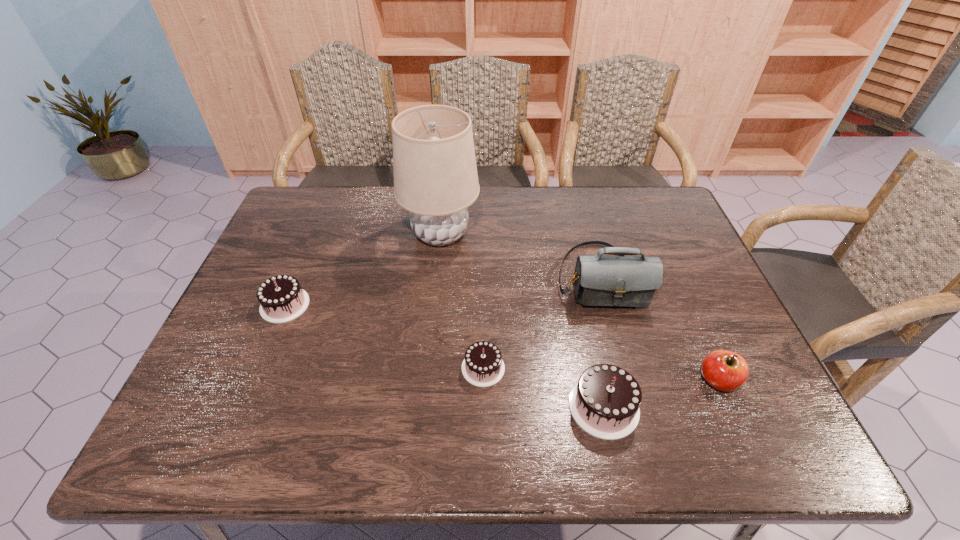
Identify the location of free space that is in between the second chocolate cake from left to right and the rightmost chocolate cake. The width and height of the screenshot is (960, 540). point(543,387).

In order to click on free point between the tallest object and the fifth shortest object in this screenshot , I will do `click(520, 256)`.

The image size is (960, 540). Identify the location of vacant area that lies between the apple and the lampshade. (579, 307).

In order to click on free area in between the third tallest object and the shoulder bag in this screenshot , I will do `click(602, 342)`.

Locate an element on the screen. The width and height of the screenshot is (960, 540). free spot between the apple and the rightmost chocolate cake is located at coordinates (660, 394).

Identify the location of the fifth closest object to the leftmost chocolate cake. (724, 370).

Identify the location of object that is the closest to the apple. (605, 402).

Locate an element on the screen. chocolate cake that stands as the closest to the shortest chocolate cake is located at coordinates (605, 402).

Locate which chocolate cake is the second closest to the apple. Please provide its 2D coordinates. Your answer should be formatted as a tuple, i.e. [(x, y)], where the tuple contains the x and y coordinates of a point satisfying the conditions above.

[(483, 366)]

Where is `vacant point that satisfies the following two spatial constraints: 1. on the back side of the farthest chocolate cake; 2. on the right side of the lampshade`? The image size is (960, 540). vacant point that satisfies the following two spatial constraints: 1. on the back side of the farthest chocolate cake; 2. on the right side of the lampshade is located at coordinates (314, 234).